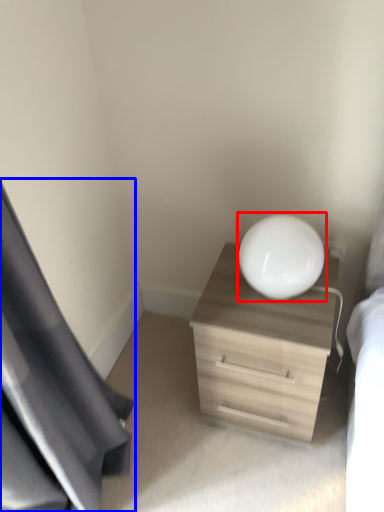
Question: Which of the following is the closest to the observer, round table (highlighted by a red box) or curtain (highlighted by a blue box)?

Choices:
 (A) round table
 (B) curtain

Answer: (B)